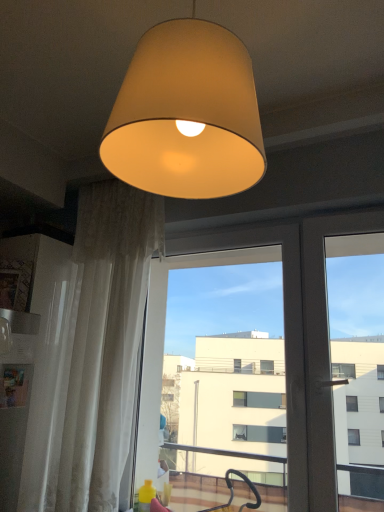
Question: Is white sheer curtain at left at the back of transparent glass screen door at center?

Choices:
 (A) no
 (B) yes

Answer: (A)

Question: Does transparent glass screen door at center touch white sheer curtain at left?

Choices:
 (A) no
 (B) yes

Answer: (A)

Question: Can you confirm if transparent glass screen door at center is shorter than white sheer curtain at left?

Choices:
 (A) no
 (B) yes

Answer: (B)

Question: From a real-world perspective, is transparent glass screen door at center on white sheer curtain at left?

Choices:
 (A) yes
 (B) no

Answer: (B)

Question: Considering the relative sizes of transparent glass screen door at center and white sheer curtain at left in the image provided, is transparent glass screen door at center taller than white sheer curtain at left?

Choices:
 (A) no
 (B) yes

Answer: (A)

Question: From the image's perspective, is transparent glass screen door at center beneath white sheer curtain at left?

Choices:
 (A) yes
 (B) no

Answer: (A)

Question: Is transparent glass screen door at center oriented away from matte beige lampshade at upper center?

Choices:
 (A) no
 (B) yes

Answer: (A)

Question: Does transparent glass screen door at center appear on the right side of matte beige lampshade at upper center?

Choices:
 (A) yes
 (B) no

Answer: (A)

Question: Is the depth of transparent glass screen door at center greater than that of matte beige lampshade at upper center?

Choices:
 (A) yes
 (B) no

Answer: (A)

Question: Can you confirm if transparent glass screen door at center is wider than matte beige lampshade at upper center?

Choices:
 (A) no
 (B) yes

Answer: (A)

Question: Can you confirm if transparent glass screen door at center is shorter than matte beige lampshade at upper center?

Choices:
 (A) no
 (B) yes

Answer: (A)

Question: Does transparent glass screen door at center turn towards matte beige lampshade at upper center?

Choices:
 (A) no
 (B) yes

Answer: (B)

Question: From a real-world perspective, is matte beige lampshade at upper center positioned under white sheer curtain at left based on gravity?

Choices:
 (A) yes
 (B) no

Answer: (B)